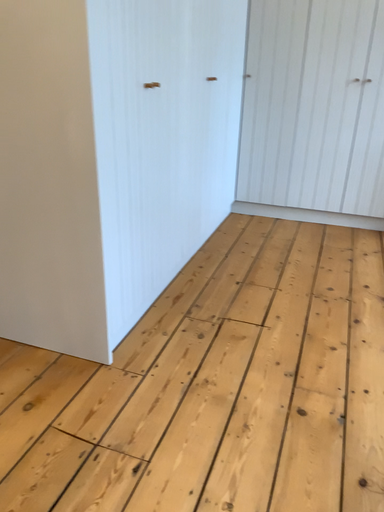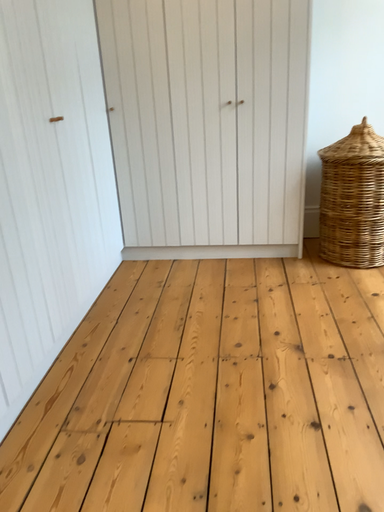
Question: How did the camera likely rotate when shooting the video?

Choices:
 (A) rotated right
 (B) rotated left

Answer: (A)